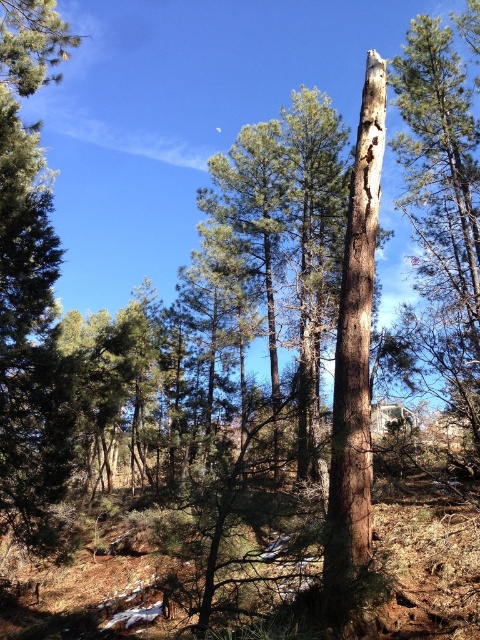
Is smooth brown tree trunk at center bigger than brown rough tree trunk at center?

Indeed, smooth brown tree trunk at center has a larger size compared to brown rough tree trunk at center.

What do you see at coordinates (443, 205) in the screenshot? I see `smooth brown tree trunk at center` at bounding box center [443, 205].

Image resolution: width=480 pixels, height=640 pixels. In order to click on smooth brown tree trunk at center in this screenshot , I will do `click(443, 205)`.